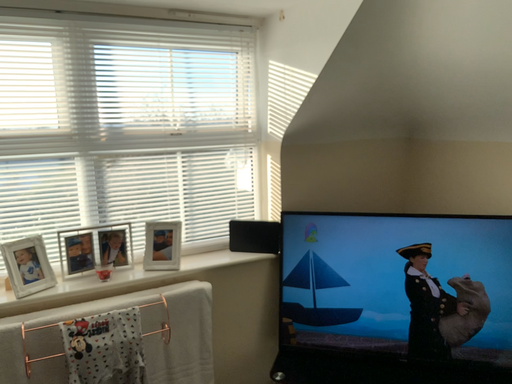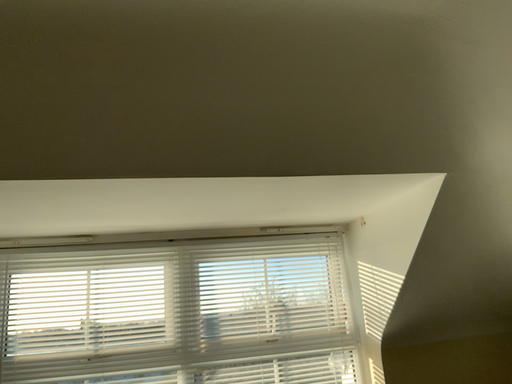
Question: How did the camera likely rotate when shooting the video?

Choices:
 (A) rotated downward
 (B) rotated upward

Answer: (B)